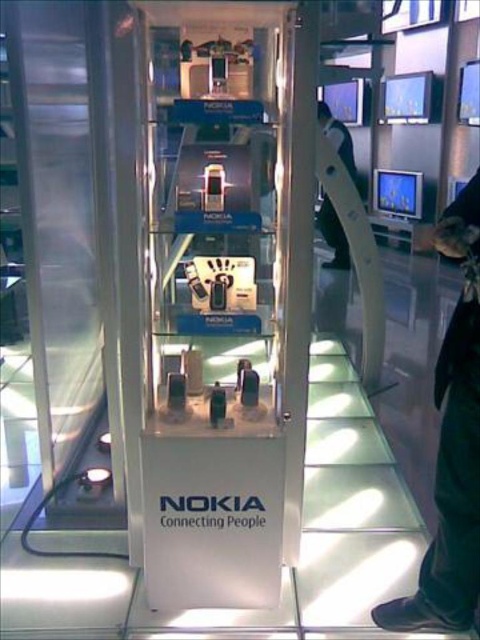
Question: Considering the relative positions of black fabric pants at lower right and black leather jacket at upper center in the image provided, where is black fabric pants at lower right located with respect to black leather jacket at upper center?

Choices:
 (A) left
 (B) right

Answer: (A)

Question: Is black fabric pants at lower right further to the viewer compared to black leather jacket at upper center?

Choices:
 (A) yes
 (B) no

Answer: (B)

Question: Which point appears closest to the camera in this image?

Choices:
 (A) (325, 234)
 (B) (416, 604)

Answer: (B)

Question: Can you confirm if black fabric pants at lower right is positioned to the right of black leather jacket at upper center?

Choices:
 (A) no
 (B) yes

Answer: (A)